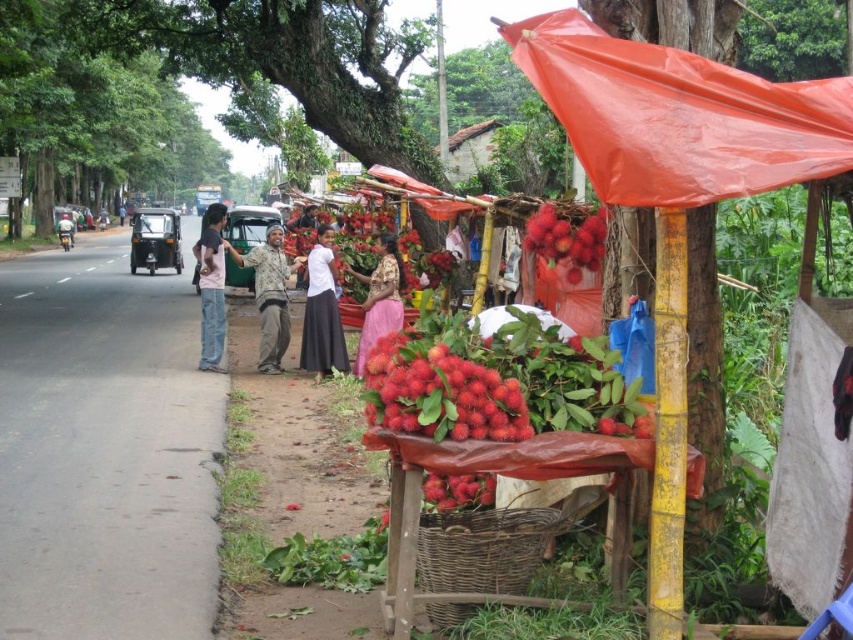
Consider the image. Between fuzzy red rambutan at center and green fabric motorcycle at left, which one is positioned higher?

green fabric motorcycle at left is higher up.

Is fuzzy red rambutan at center positioned at the back of green fabric motorcycle at left?

No, fuzzy red rambutan at center is in front of green fabric motorcycle at left.

I want to click on fuzzy red rambutan at center, so click(439, 392).

Is woven brown basket at lower center taller than jeans at left?

In fact, woven brown basket at lower center may be shorter than jeans at left.

Looking at this image, who is shorter, woven brown basket at lower center or jeans at left?

Standing shorter between the two is woven brown basket at lower center.

Does point (532, 524) come farther from viewer compared to point (212, 368)?

That is False.

The image size is (853, 640). I want to click on woven brown basket at lower center, so click(482, 548).

Which is below, fuzzy red rambutan at center or red fuzzy rambutan at center?

fuzzy red rambutan at center is below.

Find the location of `fuzzy red rambutan at center`. fuzzy red rambutan at center is located at coordinates (439, 392).